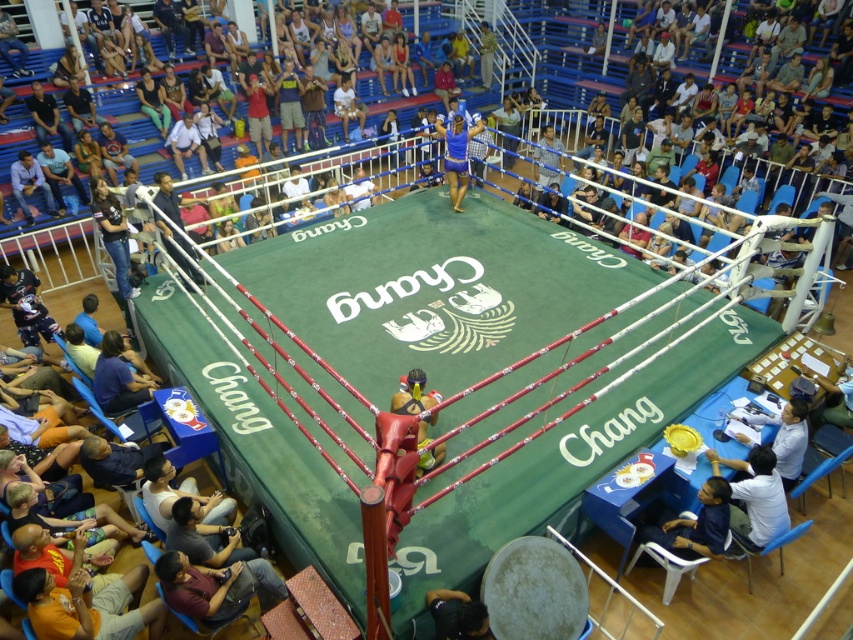
Is point (735, 513) positioned behind point (415, 392)?

Yes, it is behind point (415, 392).

Measure the distance from dark blue shirt at lower right to yellow fabric boxer at lower left.

They are 2.43 meters apart.

Does point (753, 470) come farther from viewer compared to point (401, 387)?

No, (753, 470) is closer to viewer.

Image resolution: width=853 pixels, height=640 pixels. What are the coordinates of `dark blue shirt at lower right` in the screenshot? It's located at (755, 497).

Who is shorter, maroon fabric shirt at lower left or yellow fabric boxer at lower left?

With less height is maroon fabric shirt at lower left.

Which is below, maroon fabric shirt at lower left or yellow fabric boxer at lower left?

maroon fabric shirt at lower left

Describe the element at coordinates (213, 586) in the screenshot. I see `maroon fabric shirt at lower left` at that location.

The image size is (853, 640). In order to click on maroon fabric shirt at lower left in this screenshot , I will do `click(213, 586)`.

From the picture: How distant is maroon fabric shirt at lower left from light blue shirt at lower right?

maroon fabric shirt at lower left and light blue shirt at lower right are 3.13 meters apart from each other.

Can you confirm if maroon fabric shirt at lower left is bigger than light blue shirt at lower right?

Yes.

Locate an element on the screen. maroon fabric shirt at lower left is located at coordinates (213, 586).